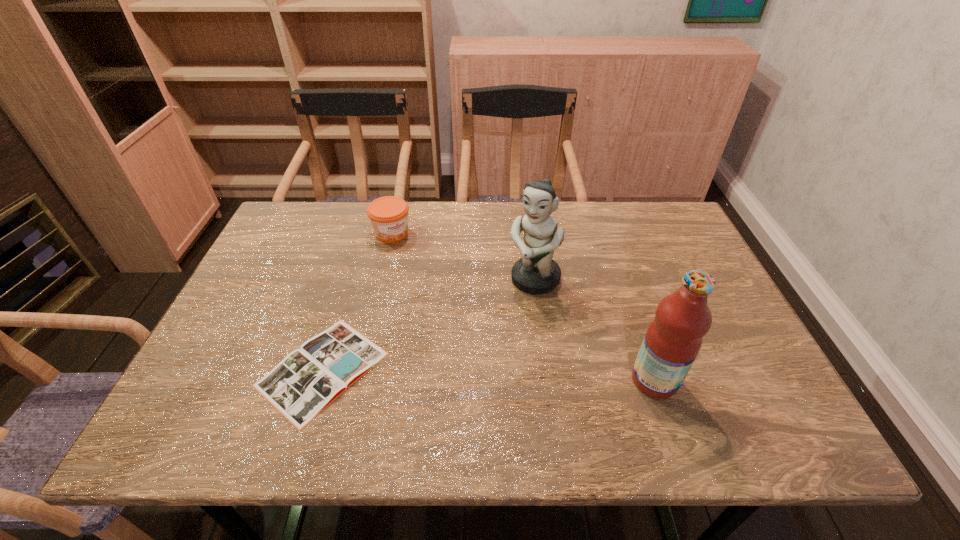
At what (x,y) coordinates should I click in order to perform the action: click on vacant space at the near edge of the desktop. Please return your answer as a coordinate pair (x, y). Image resolution: width=960 pixels, height=540 pixels. Looking at the image, I should click on (605, 389).

The width and height of the screenshot is (960, 540). In the image, there is a desktop. Find the location of `free space at the left edge`. free space at the left edge is located at coordinates (235, 302).

Where is `vacant space at the far left corner`? This screenshot has height=540, width=960. vacant space at the far left corner is located at coordinates (286, 235).

Locate an element on the screen. This screenshot has width=960, height=540. vacant space at the far right corner is located at coordinates (689, 244).

I want to click on vacant area that lies between the farthest object and the figurine, so click(x=463, y=256).

This screenshot has height=540, width=960. What are the coordinates of `free space between the shortest object and the second shortest object` in the screenshot? It's located at (357, 301).

I want to click on empty space that is in between the figurine and the jam, so click(x=463, y=256).

Identify the location of free space that is in between the jam and the shortest object. (357, 301).

Locate an element on the screen. free space between the shortest object and the jam is located at coordinates (357, 301).

This screenshot has width=960, height=540. Find the location of `free area in between the jam and the rightmost object`. free area in between the jam and the rightmost object is located at coordinates (523, 307).